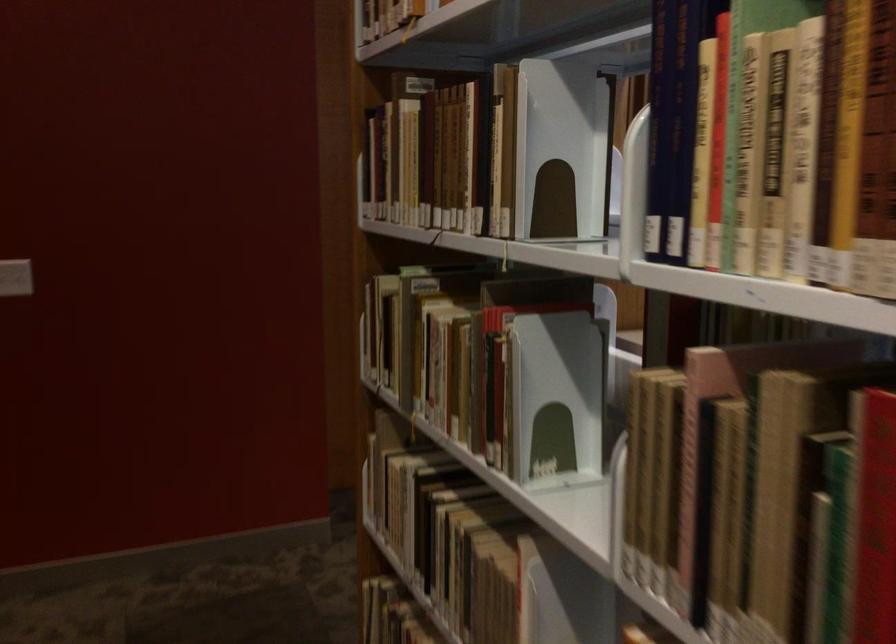
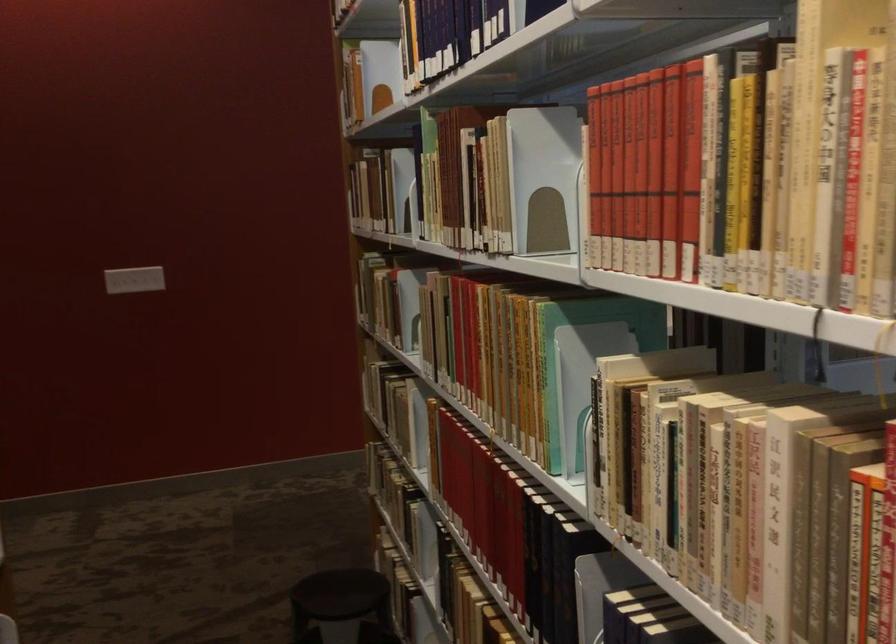
In the second image, find the point that corresponds to the point at 530,158 in the first image.

(400, 190)